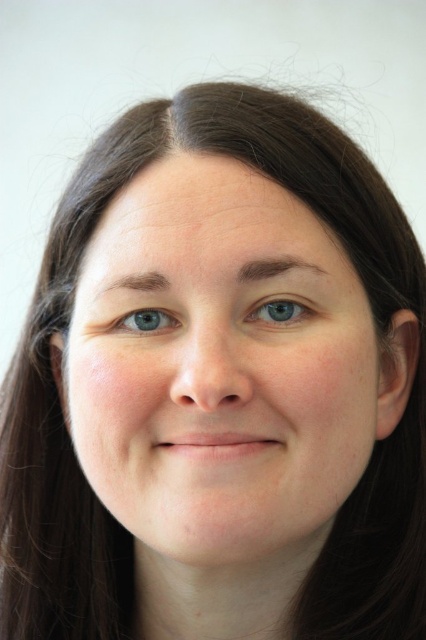
You are an artist trying to paint a portrait. You want to place a blue matte eye at center exactly where it is in the image. What coordinates should you use for its position?

The blue matte eye at center should be placed at coordinates point (279,312).

You are a photographer adjusting the lighting for a close portrait. You notice the subject has two eyes, the blue matte eye at center and the blue smooth eye at center. Which eye do you need to ensure has enough lighting since it is wider?

The blue matte eye at center requires proper lighting as it is wider than the blue smooth eye at center.

Based on the photo, you are a photographer adjusting the focus of your camera. You want to capture both the blue matte eye at center and the blue smooth eye at center in sharp detail. Given that your camera can only focus on one point at a time, which eye should you focus on to ensure both are in focus, considering their distance apart?

The blue matte eye at center and blue smooth eye at center are 5.03 centimeters apart. To ensure both are in focus, focus on the midpoint between them, which is approximately 2.515 centimeters from each eye.